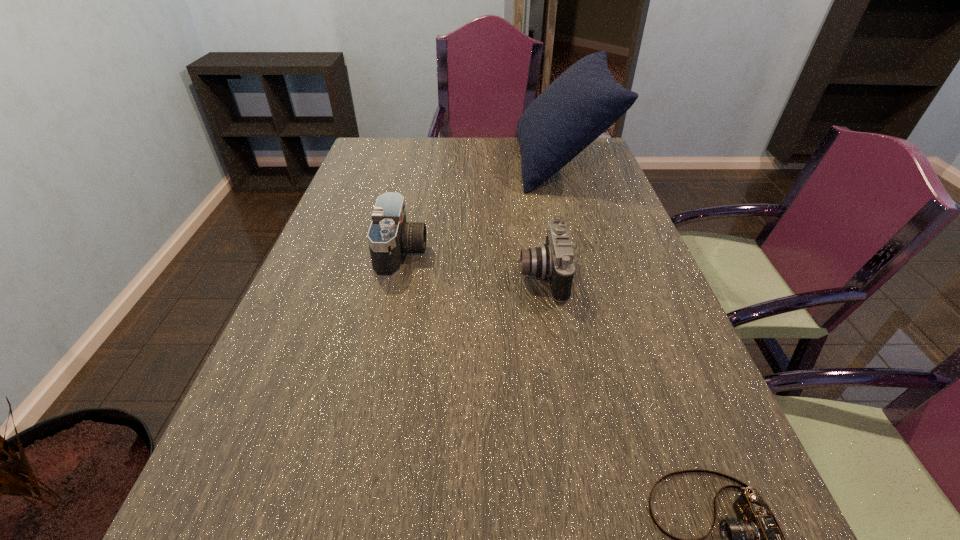
Identify the location of cushion. The image size is (960, 540). (584, 101).

Locate an element on the screen. This screenshot has width=960, height=540. the farthest object is located at coordinates (584, 101).

The image size is (960, 540). What are the coordinates of `the second camera from left to right` in the screenshot? It's located at (554, 260).

You are a GUI agent. You are given a task and a screenshot of the screen. Output one action in this format:
    pyautogui.click(x=<x>, y=<y>)
    Task: Click on the leftmost object
    
    Given the screenshot: What is the action you would take?
    pyautogui.click(x=390, y=236)

Locate an element on the screen. This screenshot has width=960, height=540. free region located on the facing side of the tallest object is located at coordinates (480, 163).

The image size is (960, 540). In order to click on free space located on the facing side of the tallest object in this screenshot , I will do `click(422, 163)`.

Where is `free space located 0.350m on the facing side of the tallest object`? The width and height of the screenshot is (960, 540). free space located 0.350m on the facing side of the tallest object is located at coordinates (417, 163).

Locate an element on the screen. vacant space located on the front-facing side of the second camera from right to left is located at coordinates (381, 276).

Find the location of `free spot located on the front-facing side of the second camera from right to left`. free spot located on the front-facing side of the second camera from right to left is located at coordinates (475, 276).

This screenshot has height=540, width=960. I want to click on free space located 0.050m on the front-facing side of the second camera from right to left, so click(x=499, y=276).